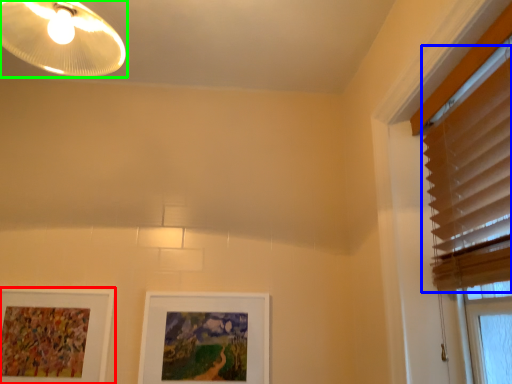
Question: Based on their relative distances, which object is nearer to picture frame (highlighted by a red box)? Choose from blind (highlighted by a blue box) and lamp (highlighted by a green box).

Choices:
 (A) blind
 (B) lamp

Answer: (B)